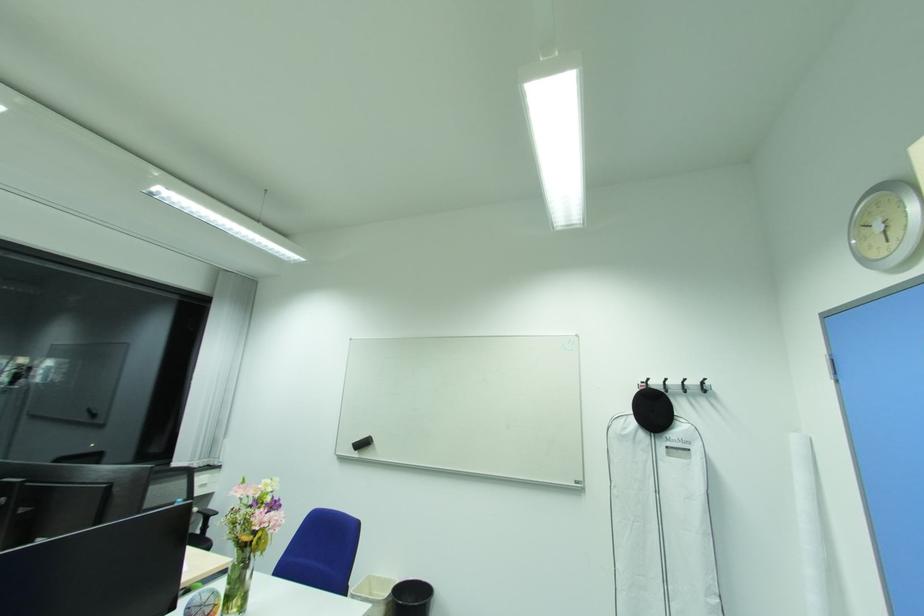
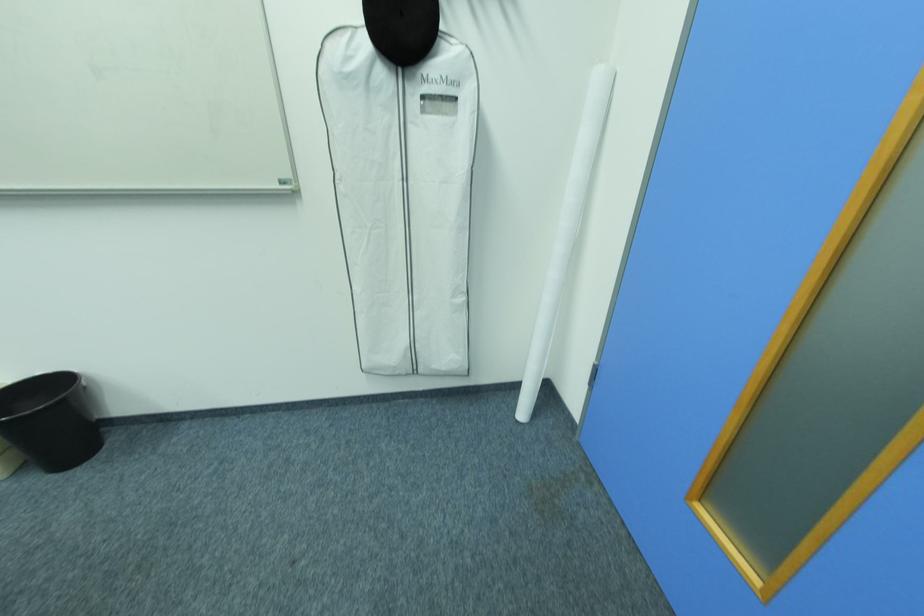
Where in the second image is the point corresponding to point 638,411 from the first image?

(368, 23)